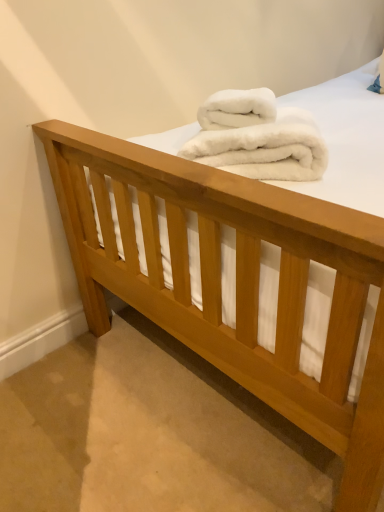
Question: In terms of height, does white fluffy towel at center, which is the second towel in bottom-to-top order, look taller or shorter compared to white fluffy towels at center, placed as the 2th towel when sorted from top to bottom?

Choices:
 (A) short
 (B) tall

Answer: (A)

Question: In the image, is white fluffy towel at center, acting as the first towel starting from the top, positioned in front of or behind white fluffy towels at center, which appears as the first towel when ordered from the bottom?

Choices:
 (A) front
 (B) behind

Answer: (B)

Question: In terms of width, does white fluffy towel at center, acting as the first towel starting from the top, look wider or thinner when compared to white fluffy towels at center, placed as the 2th towel when sorted from top to bottom?

Choices:
 (A) thin
 (B) wide

Answer: (A)

Question: Based on their sizes in the image, would you say white fluffy towels at center, which appears as the first towel when ordered from the bottom, is bigger or smaller than white fluffy towel at center, which is the second towel in bottom-to-top order?

Choices:
 (A) small
 (B) big

Answer: (B)

Question: Would you say white fluffy towels at center, which appears as the first towel when ordered from the bottom, is to the left or to the right of white fluffy towel at center, which is the second towel in bottom-to-top order, in the picture?

Choices:
 (A) right
 (B) left

Answer: (A)

Question: Is white fluffy towels at center, placed as the 2th towel when sorted from top to bottom, wider or thinner than white fluffy towel at center, acting as the first towel starting from the top?

Choices:
 (A) wide
 (B) thin

Answer: (A)

Question: Is point (284, 116) positioned closer to the camera than point (264, 116)?

Choices:
 (A) farther
 (B) closer

Answer: (B)